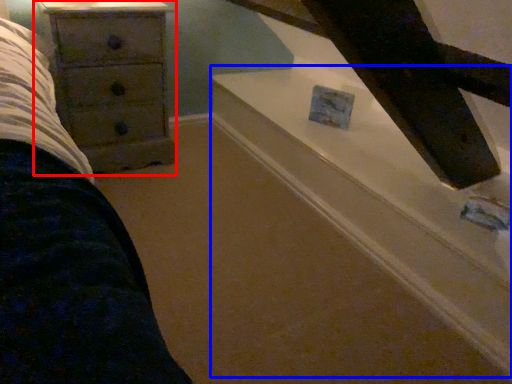
Question: Which of the following is the closest to the observer, chest of drawers (highlighted by a red box) or stairwell (highlighted by a blue box)?

Choices:
 (A) chest of drawers
 (B) stairwell

Answer: (B)